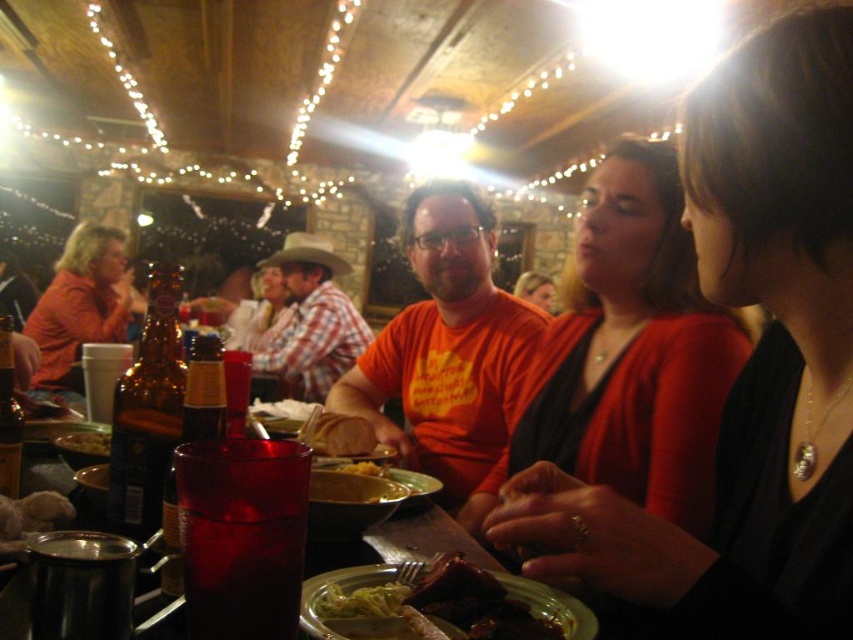
Question: Which of the following is the farthest from the observer?

Choices:
 (A) (68, 236)
 (B) (4, 420)
 (C) (201, 356)
 (D) (796, 556)

Answer: (A)

Question: Does matte black sweater at center appear on the left side of translucent glass beer bottle at left?

Choices:
 (A) yes
 (B) no

Answer: (B)

Question: From the image, what is the correct spatial relationship of translucent glass beer bottle at left in relation to yellow mashed potato at center?

Choices:
 (A) above
 (B) below

Answer: (A)

Question: Which point is farther to the camera?

Choices:
 (A) brown matte beer bottle at left
 (B) matte black sweater at center

Answer: (A)

Question: Does plaid fabric shirt at center have a greater width compared to translucent amber bottle at center left?

Choices:
 (A) no
 (B) yes

Answer: (B)

Question: Among these points, which one is nearest to the camera?

Choices:
 (A) (347, 324)
 (B) (521, 604)

Answer: (B)